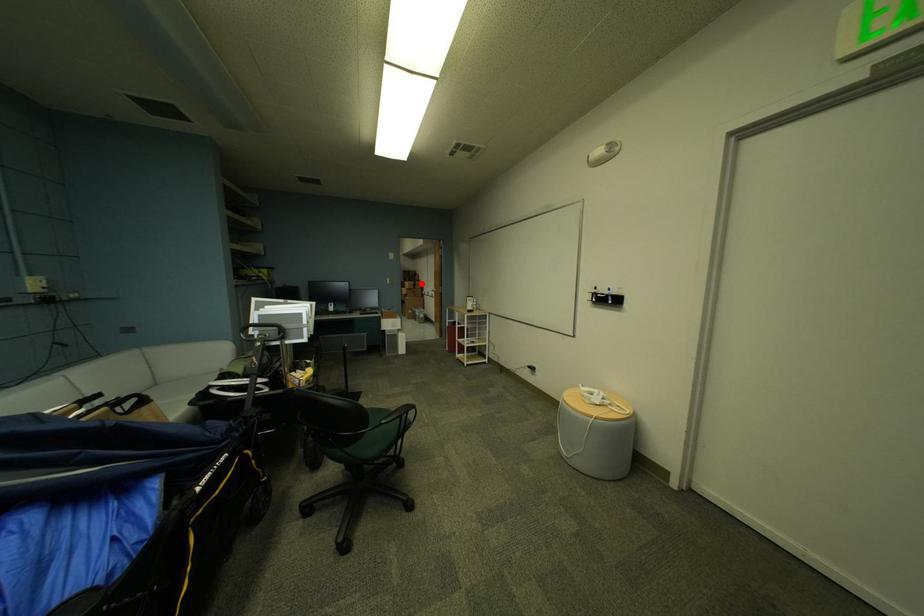
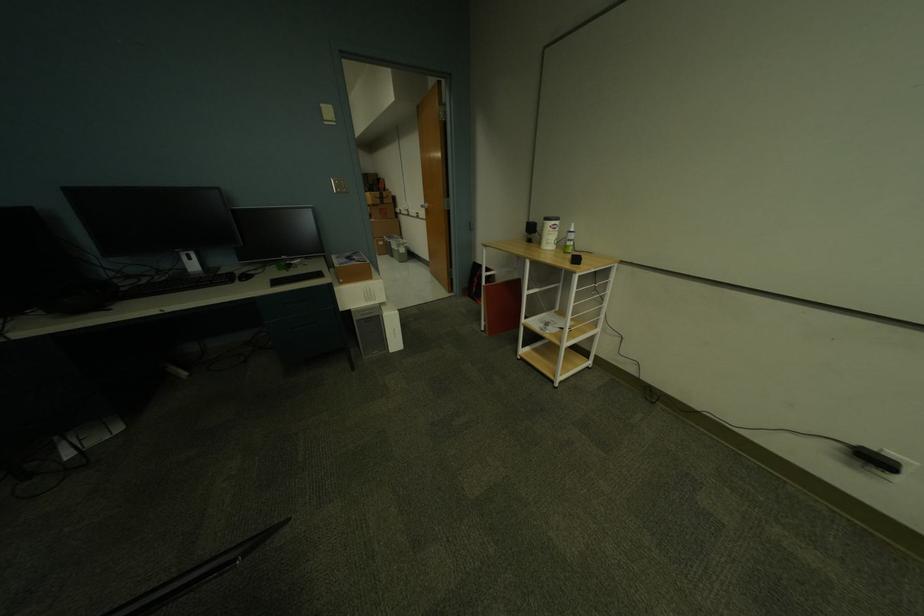
Question: A red point is marked in image1. In image2, is the corresponding 3D point closer to the camera or farther? Reply with the corresponding letter.

Choices:
 (A) The corresponding 3D point is closer.
 (B) The corresponding 3D point is farther.

Answer: (A)